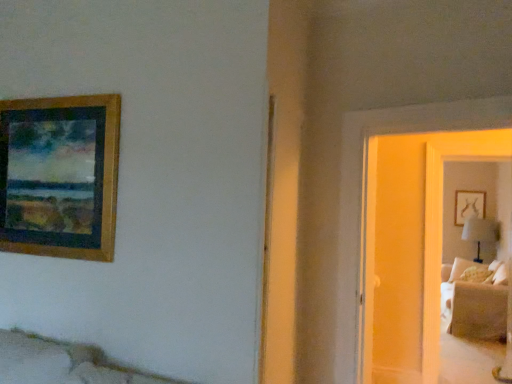
Question: Is white fabric table lamp at right further to camera compared to suede beige couch at right?

Choices:
 (A) yes
 (B) no

Answer: (A)

Question: Would you say suede beige couch at right is part of white fabric table lamp at right's contents?

Choices:
 (A) yes
 (B) no

Answer: (B)

Question: From a real-world perspective, is white fabric table lamp at right physically above suede beige couch at right?

Choices:
 (A) no
 (B) yes

Answer: (B)

Question: Can you see white fabric table lamp at right touching suede beige couch at right?

Choices:
 (A) yes
 (B) no

Answer: (B)

Question: Is the depth of white fabric table lamp at right less than that of suede beige couch at right?

Choices:
 (A) no
 (B) yes

Answer: (A)

Question: In terms of width, does matte glass door at right look wider or thinner when compared to suede beige couch at right?

Choices:
 (A) wide
 (B) thin

Answer: (B)

Question: Is point (424, 291) positioned closer to the camera than point (458, 327)?

Choices:
 (A) closer
 (B) farther

Answer: (A)

Question: From the image's perspective, is matte glass door at right located above or below suede beige couch at right?

Choices:
 (A) above
 (B) below

Answer: (A)

Question: Relative to suede beige couch at right, is matte glass door at right in front or behind?

Choices:
 (A) behind
 (B) front

Answer: (B)

Question: Is wooden picture frame at upper left situated inside suede beige couch at right or outside?

Choices:
 (A) inside
 (B) outside

Answer: (B)

Question: Considering the positions of point (33, 213) and point (444, 314), is point (33, 213) closer or farther from the camera than point (444, 314)?

Choices:
 (A) farther
 (B) closer

Answer: (B)

Question: Considering the positions of wooden picture frame at upper left and suede beige couch at right in the image, is wooden picture frame at upper left bigger or smaller than suede beige couch at right?

Choices:
 (A) big
 (B) small

Answer: (B)

Question: From a real-world perspective, relative to suede beige couch at right, is wooden picture frame at upper left vertically above or below?

Choices:
 (A) above
 (B) below

Answer: (A)

Question: Considering the relative positions of white fabric table lamp at right and suede beige couch at right in the image provided, is white fabric table lamp at right to the left or to the right of suede beige couch at right?

Choices:
 (A) left
 (B) right

Answer: (B)

Question: From the image's perspective, is white fabric table lamp at right above or below suede beige couch at right?

Choices:
 (A) below
 (B) above

Answer: (B)